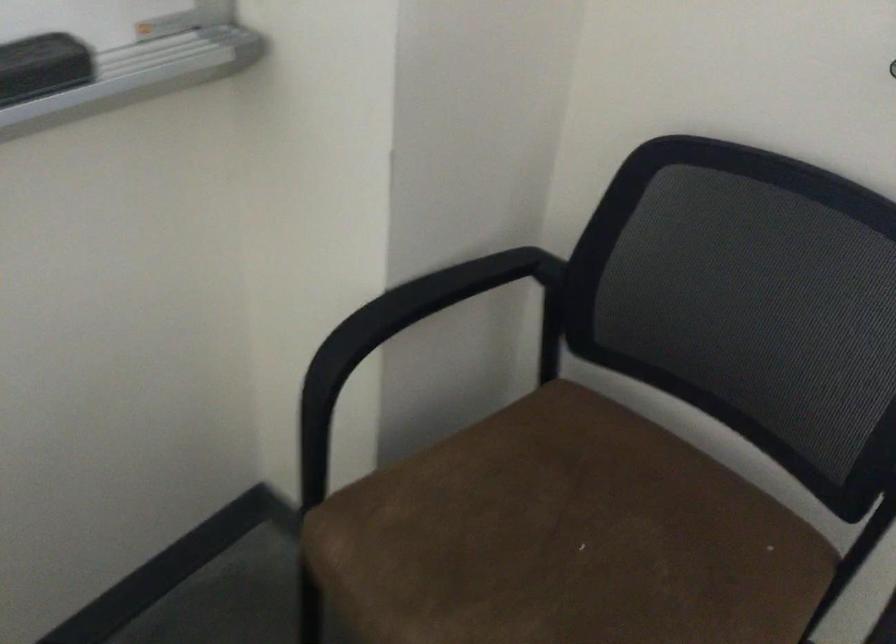
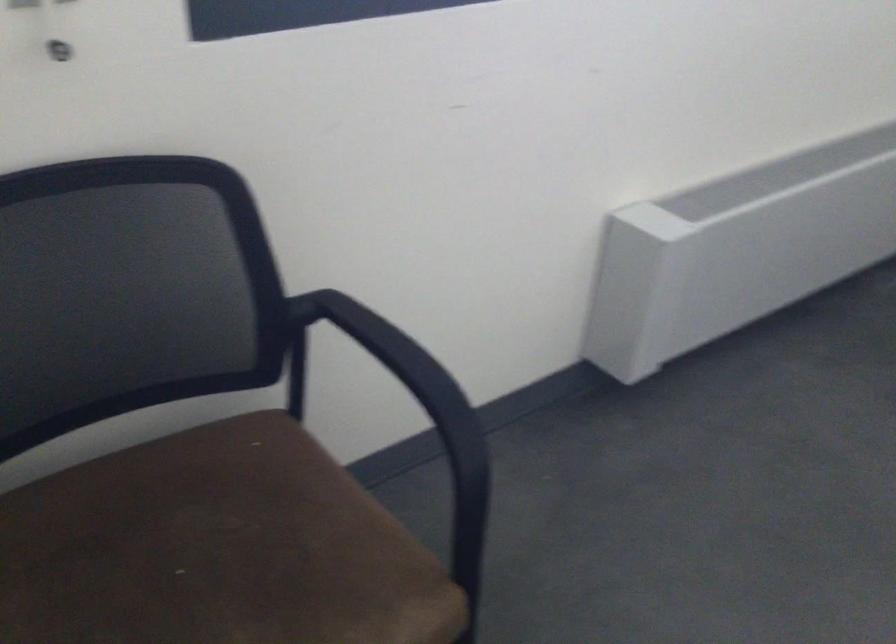
First-person continuous shooting, in which direction is the camera rotating?

The rotation direction of the camera is right-down.